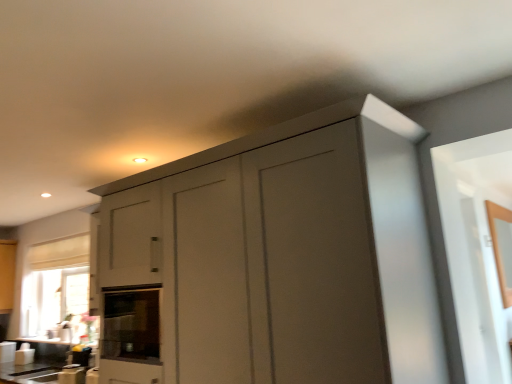
Based on the photo, measure the distance between point (116, 300) and camera.

Point (116, 300) and camera are 8.32 feet apart.

The image size is (512, 384). Describe the element at coordinates (283, 256) in the screenshot. I see `matte gray cabinet at center` at that location.

This screenshot has height=384, width=512. What are the coordinates of `white glossy countertop at lower center, which appears as the 1th counter top when viewed from the front` in the screenshot? It's located at (29, 373).

Considering the positions of objects white glossy countertop at lower center, the 2th counter top positioned from the back, and matte gray cabinet at center in the image provided, who is more to the left, white glossy countertop at lower center, the 2th counter top positioned from the back, or matte gray cabinet at center?

From the viewer's perspective, white glossy countertop at lower center, the 2th counter top positioned from the back, appears more on the left side.

Is white glossy countertop at lower center, which appears as the 1th counter top when viewed from the front, further to camera compared to matte gray cabinet at center?

Yes, white glossy countertop at lower center, which appears as the 1th counter top when viewed from the front, is behind matte gray cabinet at center.

From a real-world perspective, is white glossy countertop at lower center, the 2th counter top positioned from the back, on top of matte gray cabinet at center?

No, from a real-world perspective, white glossy countertop at lower center, the 2th counter top positioned from the back, is not over matte gray cabinet at center

From the image's perspective, relative to matte gray cabinet at center, is white glossy countertop at lower center, the 2th counter top positioned from the back, above or below?

Based on their image positions, white glossy countertop at lower center, the 2th counter top positioned from the back, is located beneath matte gray cabinet at center.

Looking at this image, from a real-world perspective, is white glossy countertop at lower left, positioned as the 1th counter top in back-to-front order, on top of black glass oven at center?

Incorrect, from a real-world perspective, white glossy countertop at lower left, positioned as the 1th counter top in back-to-front order, is lower than black glass oven at center.

Is point (48, 340) in front of point (106, 321)?

No.

Is white glossy countertop at lower left, positioned as the 1th counter top in back-to-front order, in front of black glass oven at center?

No.

The width and height of the screenshot is (512, 384). I want to click on the 2nd counter top to the left of the black glass oven at center, starting your count from the anchor, so click(x=47, y=340).

From the image's perspective, is matte gray cabinet at center on black glass oven at center?

Indeed, from the image's perspective, matte gray cabinet at center is shown above black glass oven at center.

Considering the sizes of objects matte gray cabinet at center and black glass oven at center in the image provided, who is bigger, matte gray cabinet at center or black glass oven at center?

matte gray cabinet at center.

Based on the photo, would you consider matte gray cabinet at center to be distant from black glass oven at center?

They are positioned close to each other.

The image size is (512, 384). I want to click on cupboard in front of the black glass oven at center, so click(283, 256).

From a real-world perspective, is white glossy countertop at lower left, positioned as the 1th counter top in back-to-front order, beneath white glossy countertop at lower center, which appears as the 1th counter top when viewed from the front?

No, from a real-world perspective, white glossy countertop at lower left, positioned as the 1th counter top in back-to-front order, is not under white glossy countertop at lower center, which appears as the 1th counter top when viewed from the front.

Can you see white glossy countertop at lower left, positioned as the 1th counter top in back-to-front order, touching white glossy countertop at lower center, which appears as the 1th counter top when viewed from the front?

No, white glossy countertop at lower left, positioned as the 1th counter top in back-to-front order, is not with white glossy countertop at lower center, which appears as the 1th counter top when viewed from the front.

Could you tell me if white glossy countertop at lower left, the second counter top viewed from the front, is facing white glossy countertop at lower center, the 2th counter top positioned from the back?

No, white glossy countertop at lower left, the second counter top viewed from the front, is not oriented towards white glossy countertop at lower center, the 2th counter top positioned from the back.

Consider the image. Between matte gray cabinet at center and white glossy countertop at lower left, the second counter top viewed from the front, which one has smaller size?

Smaller between the two is white glossy countertop at lower left, the second counter top viewed from the front.

In order to click on the 2nd counter top to the left of the matte gray cabinet at center, counting from the anchor's position in this screenshot , I will do `click(47, 340)`.

What's the angular difference between matte gray cabinet at center and white glossy countertop at lower left, positioned as the 1th counter top in back-to-front order,'s facing directions?

There is a 0.388-degree angle between the facing directions of matte gray cabinet at center and white glossy countertop at lower left, positioned as the 1th counter top in back-to-front order.

Is white glossy countertop at lower left, positioned as the 1th counter top in back-to-front order, at the back of matte gray cabinet at center?

No, matte gray cabinet at center is not facing the opposite direction of white glossy countertop at lower left, positioned as the 1th counter top in back-to-front order.

Is white glossy countertop at lower left, positioned as the 1th counter top in back-to-front order, not within matte gray cabinet at center?

Yes, white glossy countertop at lower left, positioned as the 1th counter top in back-to-front order, is located beyond the bounds of matte gray cabinet at center.

Is the surface of white glossy countertop at lower left, the second counter top viewed from the front, in direct contact with matte gray cabinet at center?

No, white glossy countertop at lower left, the second counter top viewed from the front, is not in contact with matte gray cabinet at center.

How far apart are white glossy countertop at lower left, the second counter top viewed from the front, and matte gray cabinet at center?

white glossy countertop at lower left, the second counter top viewed from the front, and matte gray cabinet at center are 8.15 feet apart from each other.

From the image's perspective, count 1st counter tops downward from the matte gray cabinet at center and point to it. Please provide its 2D coordinates.

[(47, 340)]

Is black glass oven at center positioned with its back to white glossy countertop at lower center, the 2th counter top positioned from the back?

No.

Measure the distance between black glass oven at center and white glossy countertop at lower center, the 2th counter top positioned from the back.

black glass oven at center is 5.09 feet from white glossy countertop at lower center, the 2th counter top positioned from the back.

From the image's perspective, who appears lower, black glass oven at center or white glossy countertop at lower center, the 2th counter top positioned from the back?

white glossy countertop at lower center, the 2th counter top positioned from the back, appears lower in the image.

In the scene shown: Is there a large distance between black glass oven at center and white glossy countertop at lower center, which appears as the 1th counter top when viewed from the front?

black glass oven at center is positioned a significant distance from white glossy countertop at lower center, which appears as the 1th counter top when viewed from the front.

The height and width of the screenshot is (384, 512). I want to click on the 2nd counter top positioned below the matte gray cabinet at center (from a real-world perspective), so click(x=29, y=373).

Image resolution: width=512 pixels, height=384 pixels. I want to click on the 2nd counter top behind the black glass oven at center, so click(x=47, y=340).

Which object lies nearer to the anchor point white glossy countertop at lower center, which appears as the 1th counter top when viewed from the front, matte gray cabinet at center or black glass oven at center?

black glass oven at center is positioned closer to the anchor white glossy countertop at lower center, which appears as the 1th counter top when viewed from the front.

Estimate the real-world distances between objects in this image. Which object is closer to white glossy countertop at lower center, the 2th counter top positioned from the back, white glossy countertop at lower left, the second counter top viewed from the front, or black glass oven at center?

Based on the image, white glossy countertop at lower left, the second counter top viewed from the front, appears to be nearer to white glossy countertop at lower center, the 2th counter top positioned from the back.

Considering their positions, is black glass oven at center positioned closer to matte gray cabinet at center than white glossy countertop at lower left, the second counter top viewed from the front?

black glass oven at center lies closer to matte gray cabinet at center than the other object.

Estimate the real-world distances between objects in this image. Which object is closer to matte gray cabinet at center, white glossy countertop at lower left, the second counter top viewed from the front, or white glossy countertop at lower center, the 2th counter top positioned from the back?

white glossy countertop at lower center, the 2th counter top positioned from the back, lies closer to matte gray cabinet at center than the other object.

Looking at the image, which one is located closer to matte gray cabinet at center, white glossy countertop at lower left, the second counter top viewed from the front, or black glass oven at center?

black glass oven at center is closer to matte gray cabinet at center.

Which object lies nearer to the anchor point black glass oven at center, white glossy countertop at lower left, positioned as the 1th counter top in back-to-front order, or white glossy countertop at lower center, the 2th counter top positioned from the back?

white glossy countertop at lower center, the 2th counter top positioned from the back, is positioned closer to the anchor black glass oven at center.

Estimate the real-world distances between objects in this image. Which object is further from white glossy countertop at lower left, the second counter top viewed from the front, matte gray cabinet at center or white glossy countertop at lower center, the 2th counter top positioned from the back?

The object further to white glossy countertop at lower left, the second counter top viewed from the front, is matte gray cabinet at center.

Which object lies nearer to the anchor point white glossy countertop at lower left, the second counter top viewed from the front, black glass oven at center or matte gray cabinet at center?

The object closer to white glossy countertop at lower left, the second counter top viewed from the front, is black glass oven at center.

This screenshot has width=512, height=384. What are the coordinates of `oven positioned between matte gray cabinet at center and white glossy countertop at lower center, which appears as the 1th counter top when viewed from the front, from near to far` in the screenshot? It's located at (132, 324).

You are a GUI agent. You are given a task and a screenshot of the screen. Output one action in this format:
    pyautogui.click(x=<x>, y=<y>)
    Task: Click on the counter top positioned between matte gray cabinet at center and white glossy countertop at lower left, the second counter top viewed from the front, from near to far
    
    Given the screenshot: What is the action you would take?
    pyautogui.click(x=29, y=373)

Find the location of a particular element. This screenshot has height=384, width=512. counter top between black glass oven at center and white glossy countertop at lower left, the second counter top viewed from the front, in the front-back direction is located at coordinates (29, 373).

At what (x,y) coordinates should I click in order to perform the action: click on oven between matte gray cabinet at center and white glossy countertop at lower left, the second counter top viewed from the front, along the z-axis. Please return your answer as a coordinate pair (x, y). Looking at the image, I should click on (132, 324).